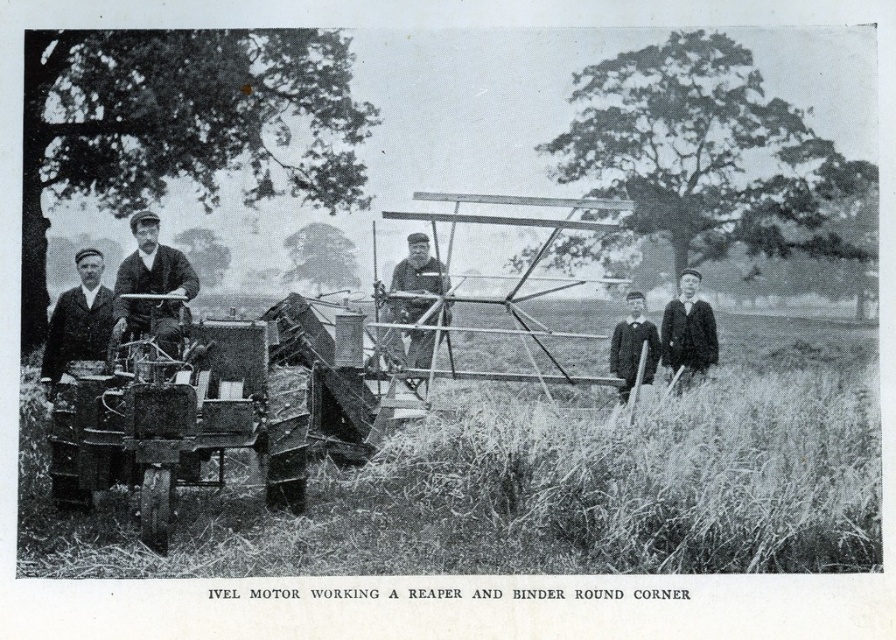
You are a fashion historian examining this historical photograph. You notice two garments in the scene. The first is a smooth black suit at right, and the second is a dark woolen sweater at center. Which garment is covering the other one?

The smooth black suit at right is positioned over the dark woolen sweater at center, meaning it is covering the sweater.

You are a tailor observing the scene and need to determine which item is narrower between the smooth fabric suit at left and the smooth wood chair at center. Which one is narrower?

The smooth fabric suit at left is narrower than the smooth wood chair at center.

You are standing 10 meters away from the reaper and binder machine in the image. Can you reach the point marked at coordinates point (x=54, y=333) without moving closer than your current position?

The point marked at coordinates point (x=54, y=333) is 11.45 meters away from the viewer. Since you are currently 10 meters away, you cannot reach that point without moving closer.